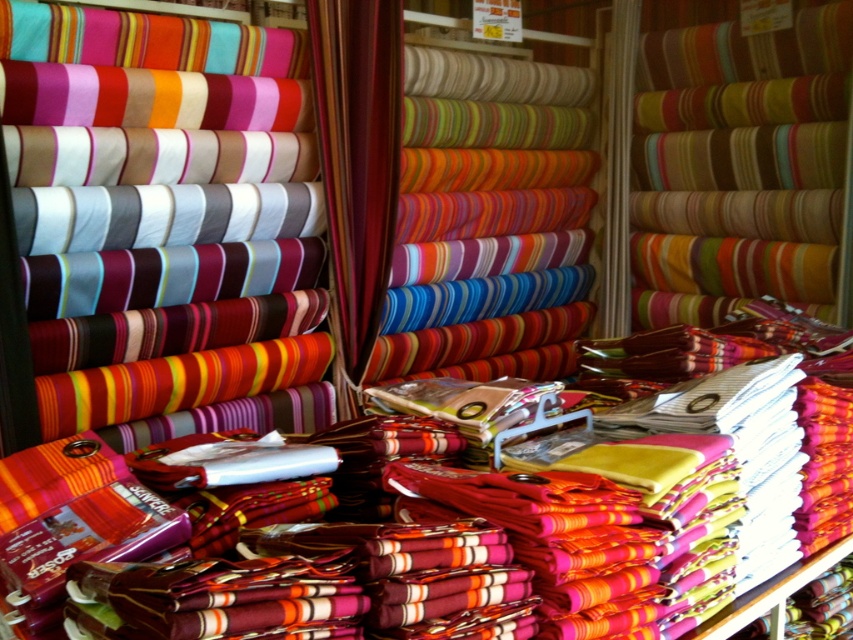
You are a customer in the fabric shop and want to know which fabric is shorter between the multicolored striped fabric at center and the silky striped fabric at center. Which one is shorter?

The multicolored striped fabric at center is not as tall as silky striped fabric at center, so the multicolored striped fabric at center is shorter.

You are standing in the fabric shop and want to determine which of the two points, point (670, 189) or point (387, 74), is closer to you. Based on the image, which point is nearer?

Point (670, 189) is closer to you because it is further to the viewer than point (387, 74).